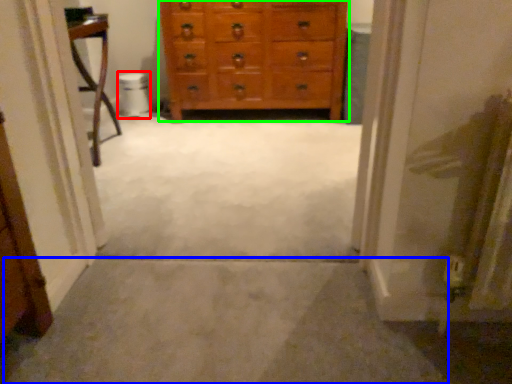
Question: Considering the real-world distances, which object is farthest from toilet bowl (highlighted by a red box)? path (highlighted by a blue box) or chest of drawers (highlighted by a green box)?

Choices:
 (A) path
 (B) chest of drawers

Answer: (A)